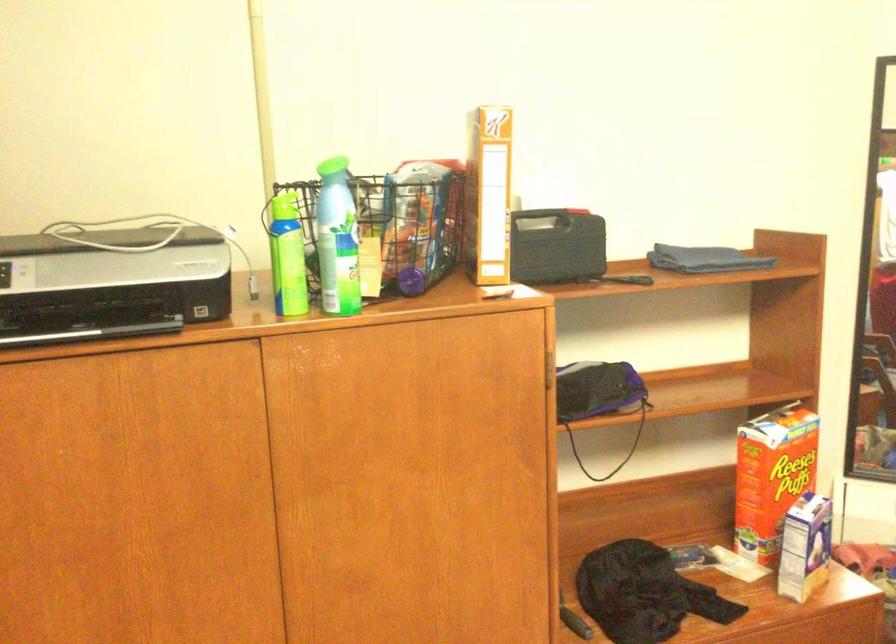
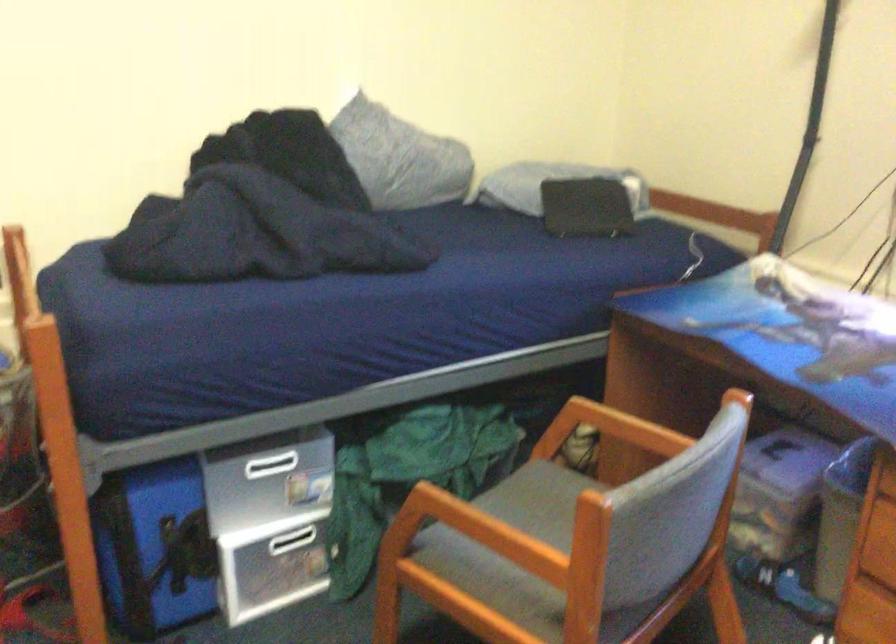
Question: The camera is either moving clockwise (left) or counter-clockwise (right) around the object. The first image is from the beginning of the video and the second image is from the end. Is the camera moving left or right when shooting the video?

Choices:
 (A) Left
 (B) Right

Answer: (A)